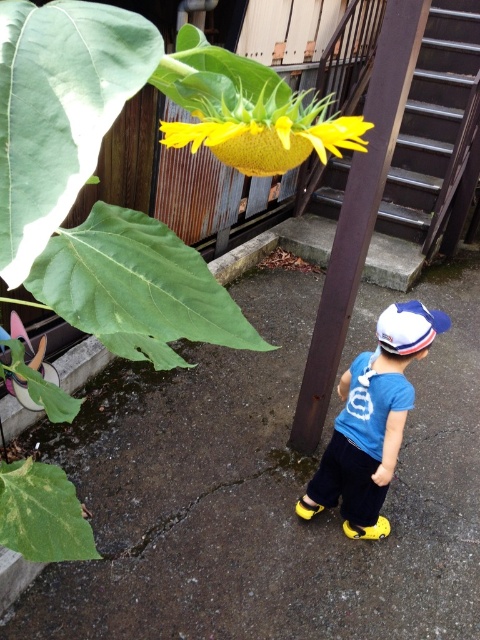
You are a painter standing 1.5 meters away from the brown wood pole at center. Can you reach the top of the pole without moving closer?

The brown wood pole at center is 1.67 meters from viewer, so if you are standing 1.5 meters away, you are closer than the pole. Therefore, you can reach the top of the brown wood pole at center.

You are a photographer trying to take a clear picture of the white fabric baseball cap at lower center. However, the brown wood pole at center is blocking your view. Can you move the pole to the side to get a clear shot?

The brown wood pole at center is in front of the white fabric baseball cap at lower center, so moving the pole would allow you to see the cap clearly.